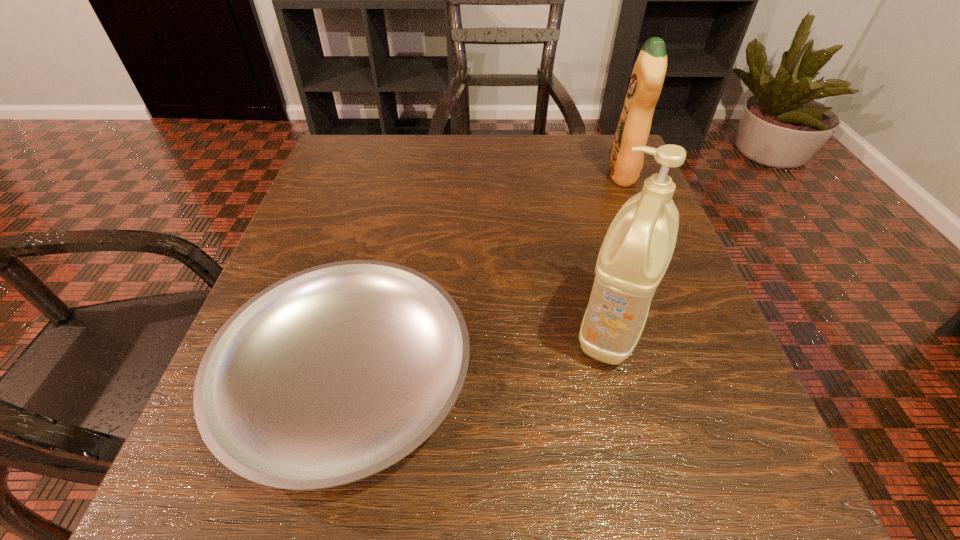
What are the coordinates of `blank space at the far left corner` in the screenshot? It's located at (370, 156).

Where is `free space at the near left corner of the desktop`? This screenshot has width=960, height=540. free space at the near left corner of the desktop is located at coordinates pos(194,458).

You are a GUI agent. You are given a task and a screenshot of the screen. Output one action in this format:
    pyautogui.click(x=<x>, y=<y>)
    Task: Click on the vacant space at the far right corner
    Image resolution: width=960 pixels, height=540 pixels.
    Given the screenshot: What is the action you would take?
    pyautogui.click(x=606, y=180)

Identify the location of free space between the leftmost object and the farthest object. The height and width of the screenshot is (540, 960). (486, 277).

Identify the location of empty space that is in between the shortest object and the left detergent. This screenshot has width=960, height=540. (480, 354).

Identify the location of free space between the right detergent and the bedpan. Image resolution: width=960 pixels, height=540 pixels. (486, 277).

Locate an element on the screen. Image resolution: width=960 pixels, height=540 pixels. free area in between the leftmost object and the left detergent is located at coordinates (480, 354).

Image resolution: width=960 pixels, height=540 pixels. What are the coordinates of `empty location between the leftmost object and the second object from left to right` in the screenshot? It's located at (480, 354).

Locate an element on the screen. This screenshot has width=960, height=540. vacant area that lies between the leftmost object and the rightmost object is located at coordinates (486, 277).

The width and height of the screenshot is (960, 540). I want to click on object that is the closest to the second object from right to left, so click(330, 375).